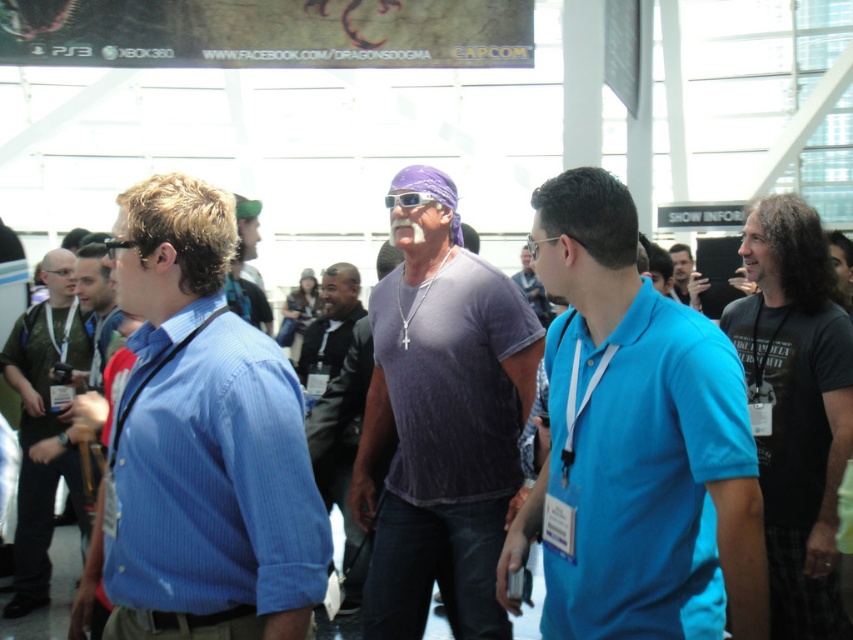
You are organizing a photo shoot and need to ensure that the blue cotton polo shirt at center and the purple knit sweater at center are visible in the frame. Based on their positions, which clothing item might require more space to fully capture in the photo?

The blue cotton polo shirt at center might require more space to fully capture in the photo since it is wider than the purple knit sweater at center.

You are standing at the convention and want to move from the point marked as point (735, 506) to point (349, 269). Which direction should you move to get closer to your destination?

To move from point (735, 506) to point (349, 269), you should move diagonally towards the lower left direction since point (349, 269) is located to the lower left of point (735, 506).